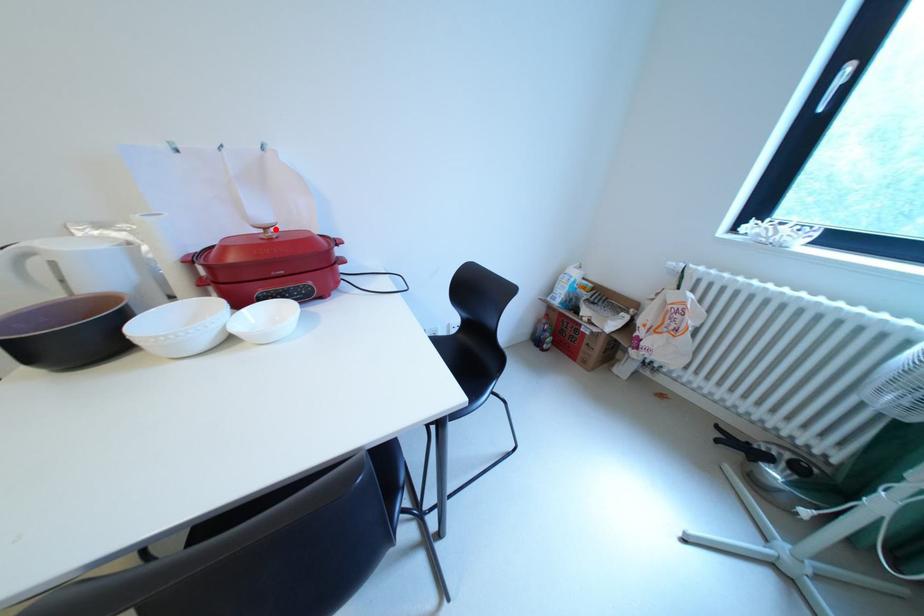
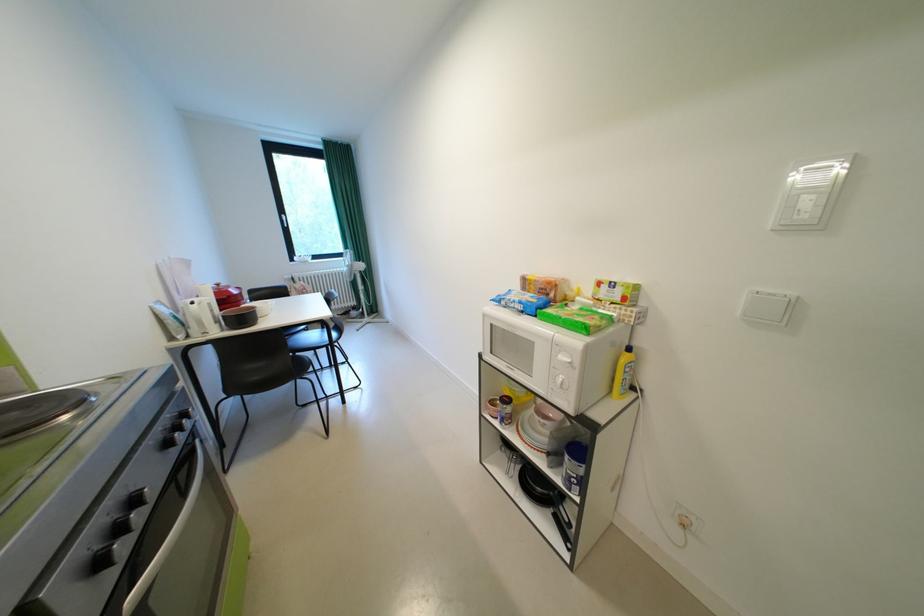
Locate, in the second image, the point that corresponds to the highlighted location in the first image.

(228, 286)